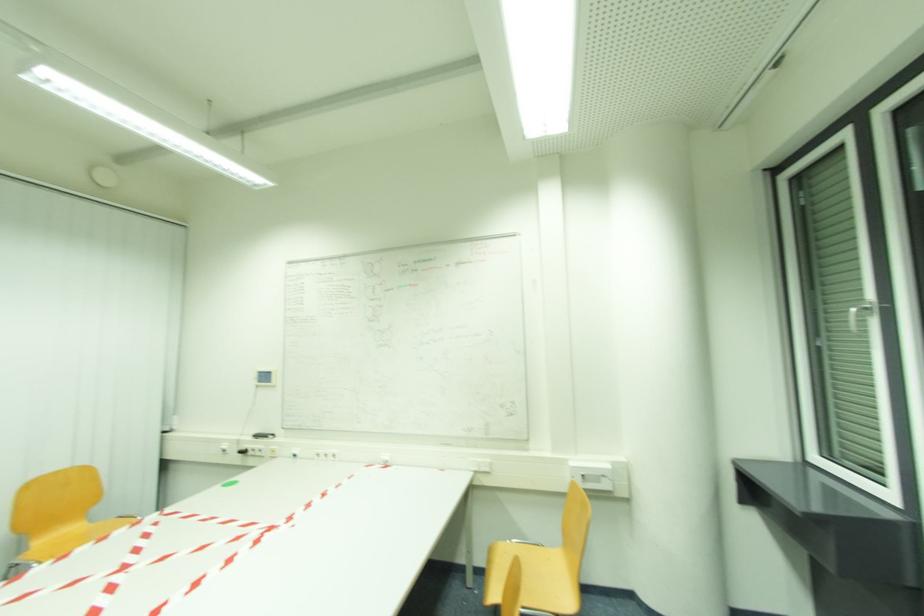
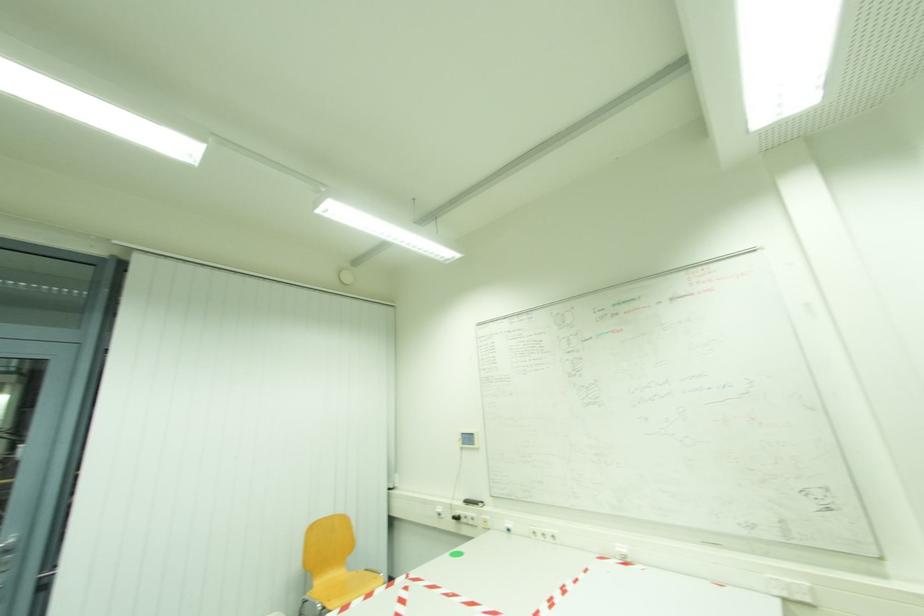
Question: The images are taken continuously from a first-person perspective. In which direction are you moving?

Choices:
 (A) Left
 (B) Right
 (C) Forward
 (D) Backward

Answer: (A)